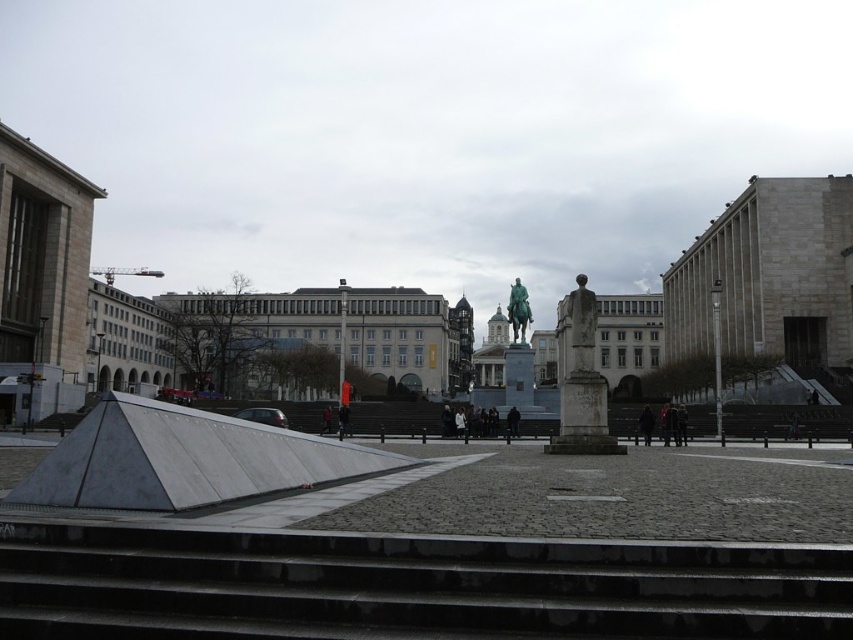
Question: Which object appears farthest from the camera in this image?

Choices:
 (A) gold polished statue at center
 (B) bronze statue at center
 (C) white stone statue at center

Answer: (A)

Question: Does bronze statue at center appear under white stone statue at center?

Choices:
 (A) no
 (B) yes

Answer: (A)

Question: Can you confirm if bronze statue at center is positioned to the left of white stone statue at center?

Choices:
 (A) yes
 (B) no

Answer: (B)

Question: Can you confirm if bronze statue at center is positioned below white stone statue at center?

Choices:
 (A) yes
 (B) no

Answer: (B)

Question: Which object is closer to the camera taking this photo?

Choices:
 (A) white stone statue at center
 (B) gold polished statue at center

Answer: (A)

Question: Which point appears farthest from the camera in this image?

Choices:
 (A) [x=590, y=305]
 (B) [x=555, y=445]
 (C) [x=521, y=307]

Answer: (C)